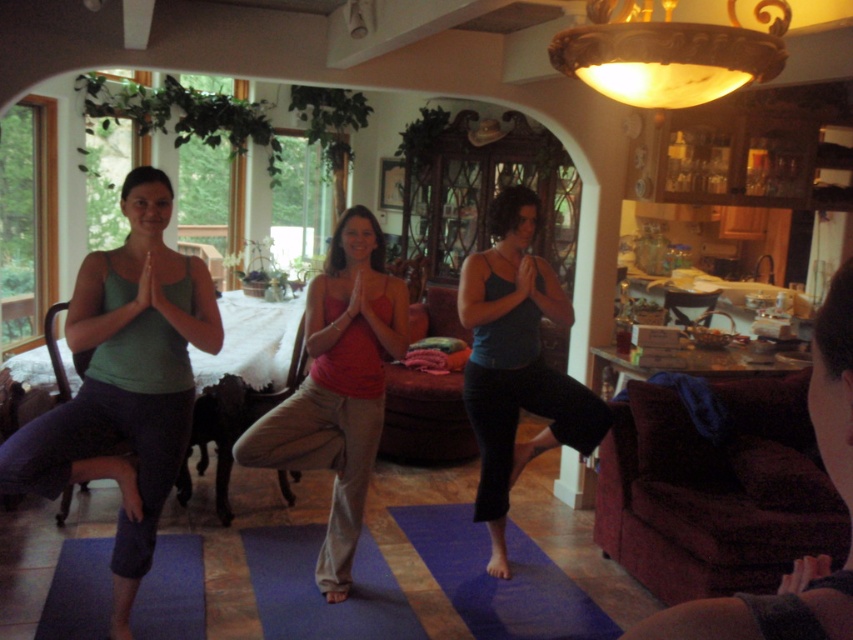
Is matte red tank top at center to the left of blue rubber mat at center from the viewer's perspective?

Indeed, matte red tank top at center is positioned on the left side of blue rubber mat at center.

Can you confirm if matte red tank top at center is smaller than blue rubber mat at center?

Incorrect, matte red tank top at center is not smaller in size than blue rubber mat at center.

Image resolution: width=853 pixels, height=640 pixels. Describe the element at coordinates (338, 387) in the screenshot. I see `matte red tank top at center` at that location.

At what (x,y) coordinates should I click in order to perform the action: click on matte red tank top at center. Please return your answer as a coordinate pair (x, y). The height and width of the screenshot is (640, 853). Looking at the image, I should click on (338, 387).

Who is positioned more to the left, matte blue tank top at center or blue rubber mat at center?

From the viewer's perspective, blue rubber mat at center appears more on the left side.

Which of these two, matte blue tank top at center or blue rubber mat at center, stands taller?

With more height is matte blue tank top at center.

Is point (560, 316) behind point (430, 509)?

No, it is not.

Locate an element on the screen. Image resolution: width=853 pixels, height=640 pixels. matte blue tank top at center is located at coordinates click(x=515, y=362).

Can you confirm if green matte tank top at center is positioned to the right of blue rubber mat at center?

Incorrect, green matte tank top at center is not on the right side of blue rubber mat at center.

Which of these two, green matte tank top at center or blue rubber mat at center, stands shorter?

blue rubber mat at center

Is point (163, 346) positioned in front of point (555, 593)?

Yes, point (163, 346) is closer to viewer.

This screenshot has height=640, width=853. In order to click on green matte tank top at center in this screenshot , I will do `click(125, 381)`.